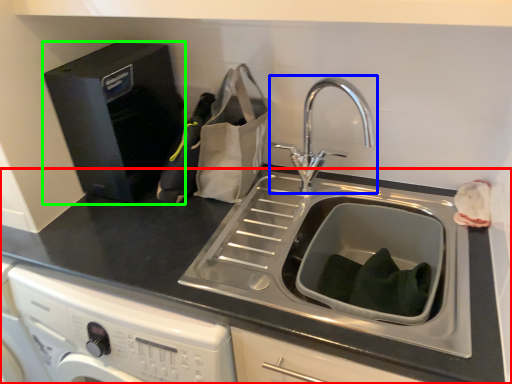
Question: Estimate the real-world distances between objects in this image. Which object is closer to countertop (highlighted by a red box), tap (highlighted by a blue box) or appliance (highlighted by a green box)?

Choices:
 (A) tap
 (B) appliance

Answer: (B)